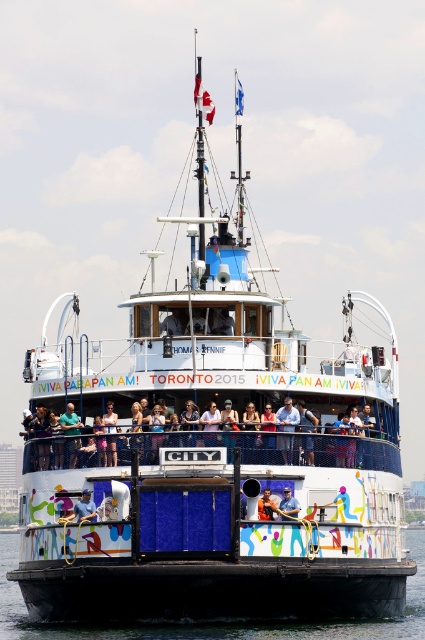
You are on the ferry boat and want to take a photo of both the point at position (65,429) and the point at position (295,634). Which point should you position closer to the camera to ensure both are in the frame?

To capture both points in the frame, position yourself closer to point (295,634) since point (65,429) is behind it, ensuring both are visible.

You are standing on the deck of the ferry and notice a point marked at coordinates (201, 442). What object is located at that point?

The point at coordinates (201, 442) indicates the location of the light blue fabric at center.